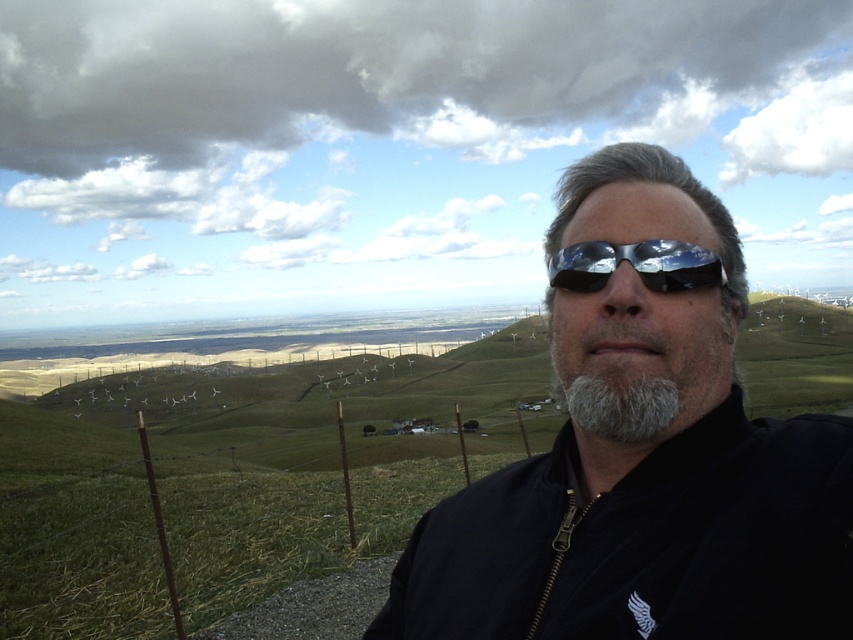
Measure the distance between graysoftbeard at center and camera.

graysoftbeard at center and camera are 1.05 meters apart from each other.

Which is in front, point (555, 368) or point (677, 388)?

Point (677, 388)

Locate an element on the screen. graysoftbeard at center is located at coordinates (639, 365).

Is glossy plastic sunglasses at center closer to the viewer compared to gray matte beard at center?

No, glossy plastic sunglasses at center is behind gray matte beard at center.

Is point (563, 276) positioned behind point (657, 404)?

Yes.

You are a GUI agent. You are given a task and a screenshot of the screen. Output one action in this format:
    pyautogui.click(x=<x>, y=<y>)
    Task: Click on the glossy plastic sunglasses at center
    The width and height of the screenshot is (853, 640).
    Given the screenshot: What is the action you would take?
    coord(636,266)

Is point (838, 609) in front of point (619, 436)?

Yes, point (838, 609) is closer to viewer.

Who is more forward, [601,548] or [669,419]?

Point [669,419]

The image size is (853, 640). I want to click on shiny black sunglasses at center, so click(643, 467).